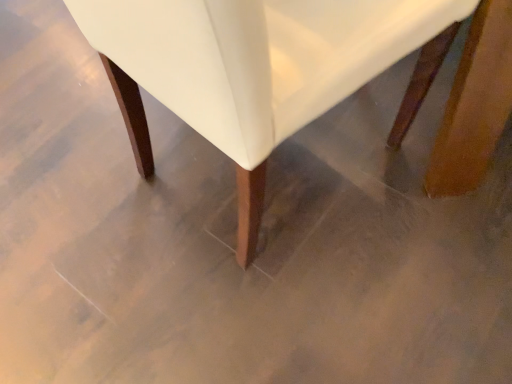
Image resolution: width=512 pixels, height=384 pixels. What do you see at coordinates (252, 68) in the screenshot? I see `matte white chair at center` at bounding box center [252, 68].

Locate an element on the screen. This screenshot has height=384, width=512. matte white chair at center is located at coordinates (252, 68).

What are the coordinates of `matte white chair at center` in the screenshot? It's located at (252, 68).